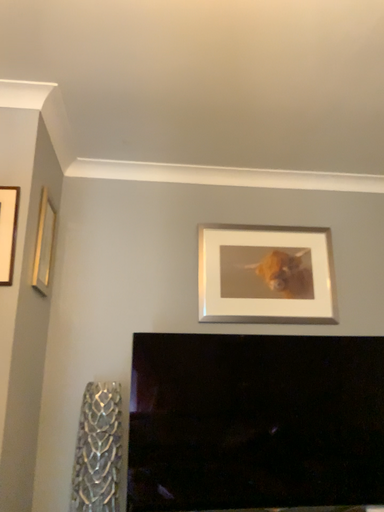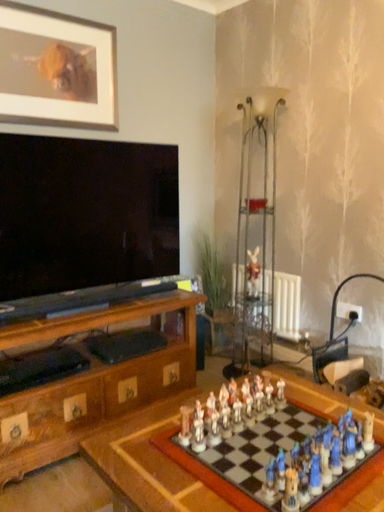
Question: Which way did the camera rotate in the video?

Choices:
 (A) rotated right
 (B) rotated left

Answer: (A)